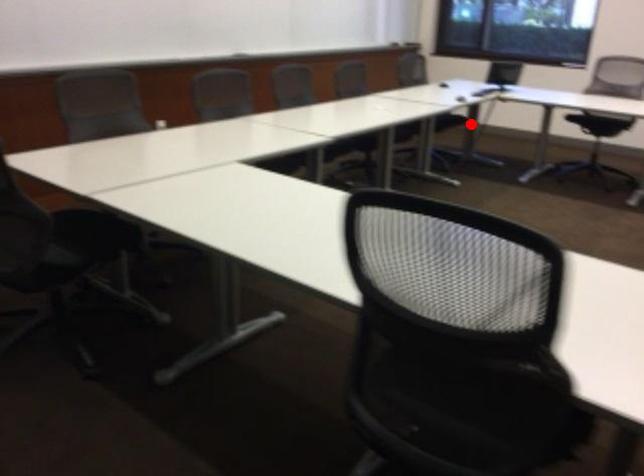
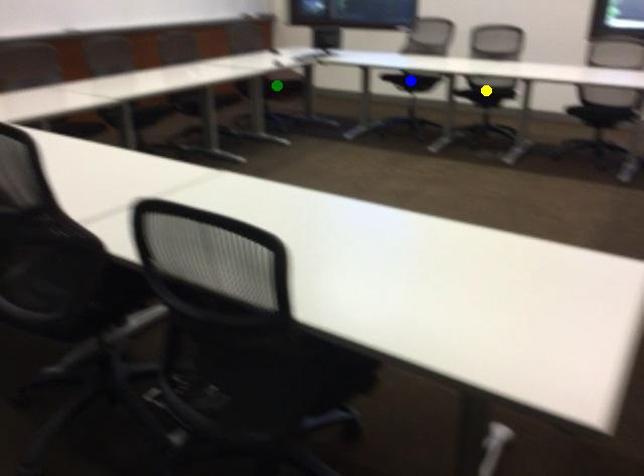
Question: I am providing you with two images of the same scene from different viewpoints. A red point is marked on the first image. You are given multiple points on the second image. Can you choose the point in image 2 that corresponds to the point in image 1?

Choices:
 (A) yellow point
 (B) blue point
 (C) green point

Answer: (C)